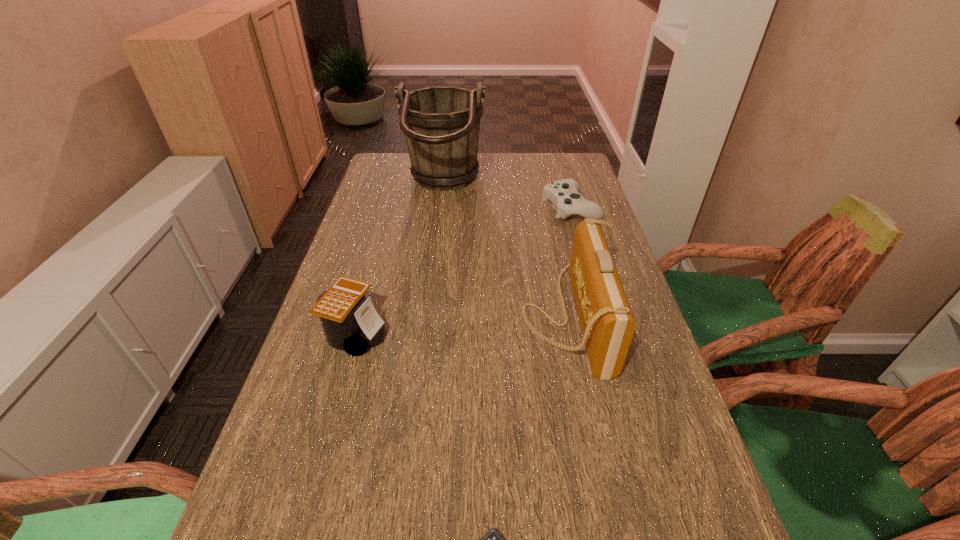
You are a GUI agent. You are given a task and a screenshot of the screen. Output one action in this format:
    pyautogui.click(x=<x>, y=<y>)
    Task: Click on the vacant space located on the left of the fourth tallest object
    The width and height of the screenshot is (960, 540).
    Given the screenshot: What is the action you would take?
    pyautogui.click(x=442, y=207)

Image resolution: width=960 pixels, height=540 pixels. I want to click on object located in the far edge section of the desktop, so click(x=441, y=124).

Identify the location of bucket that is at the left edge. (441, 124).

Where is `calculator situated at the left edge`? This screenshot has height=540, width=960. calculator situated at the left edge is located at coordinates (350, 322).

The image size is (960, 540). Find the location of `handbag that is at the right edge`. handbag that is at the right edge is located at coordinates (607, 323).

You are a GUI agent. You are given a task and a screenshot of the screen. Output one action in this format:
    pyautogui.click(x=<x>, y=<y>)
    Task: Click on the control present at the right edge
    The width and height of the screenshot is (960, 540).
    Given the screenshot: What is the action you would take?
    pyautogui.click(x=564, y=195)

I want to click on object present at the far left corner, so tap(441, 124).

This screenshot has height=540, width=960. Find the location of `vacant space at the left edge of the desktop`. vacant space at the left edge of the desktop is located at coordinates (372, 215).

Locate an element on the screen. This screenshot has width=960, height=540. vacant space at the right edge of the desktop is located at coordinates (695, 468).

Where is `vacant space that's between the fourth tallest object and the third shortest object`? Image resolution: width=960 pixels, height=540 pixels. vacant space that's between the fourth tallest object and the third shortest object is located at coordinates (463, 270).